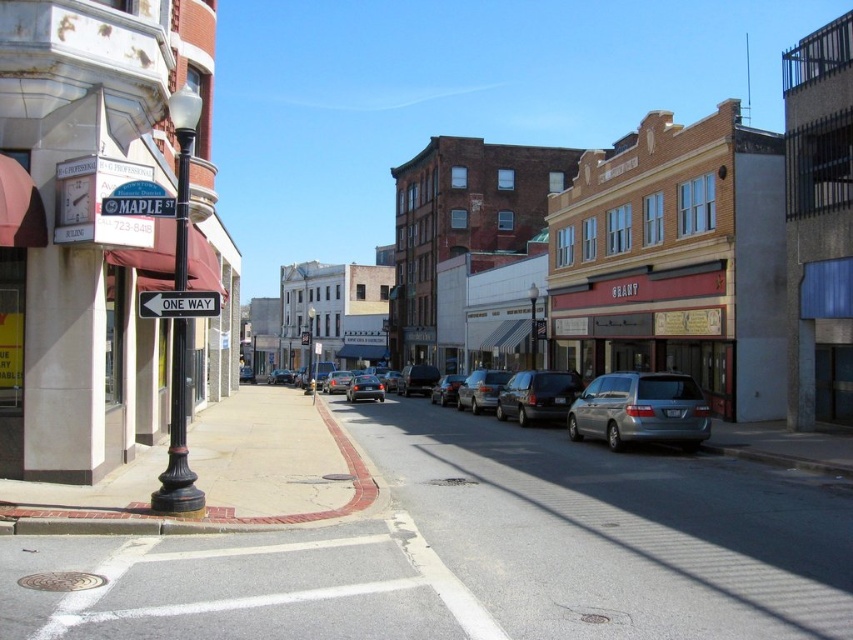
You are a delivery person trying to park your 1.8 meters tall box in the space between the satin silver minivan at center and the shiny black sedan at center. Can the box fit vertically between them?

The satin silver minivan at center is taller than the shiny black sedan at center. The vertical space between them would depend on their height difference. Since the box is 1.8 meters tall, if the gap between the vehicles is at least 1.8 meters, it can fit. However, without knowing the exact gap height, we cannot confirm. The information provided only states the minivan is taller, but not by how much.

You are a delivery driver who needs to park your vehicle between the black matte van at center and the shiny silver sedan at center. Given that your delivery van is 5 meters long, can you fit it there?

The black matte van at center is smaller than the shiny silver sedan at center, but the distance between them isn not specified. Without knowing the exact space between the two vehicles, it is impossible to determine if your 5 meter long delivery van can fit there.